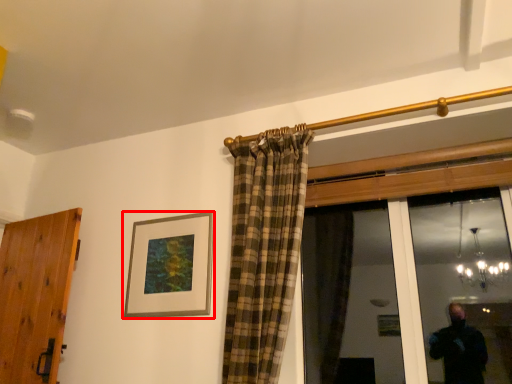
Question: From the image's perspective, considering the relative positions of picture frame (annotated by the red box) and door in the image provided, where is picture frame (annotated by the red box) located with respect to the staircase?

Choices:
 (A) above
 (B) below

Answer: (A)